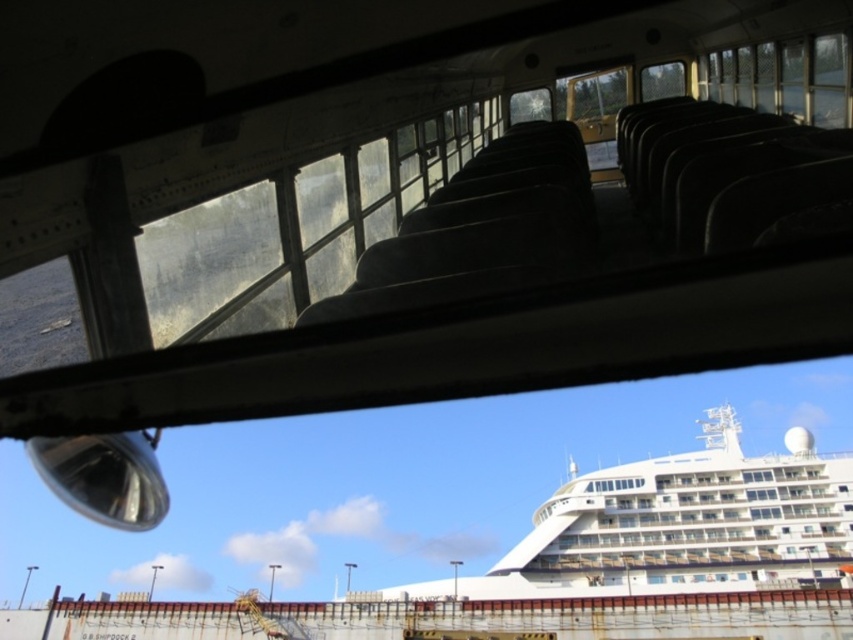
You are a passenger sitting inside the old bus and looking out through the window. You notice the white glossy cruise ship at center and the transparent plastic view mirror at lower left. Which object is positioned higher from your viewpoint?

The transparent plastic view mirror at lower left is positioned higher than the white glossy cruise ship at center from your viewpoint.

You are a passenger sitting inside the old bus and looking out through the window. You notice the white glossy cruise ship at center and the transparent plastic view mirror at lower left. Which object is located to the right side of the other?

The white glossy cruise ship at center is positioned on the right side of the transparent plastic view mirror at lower left.

You are inside the old bus looking out the window. You see two points marked on the window. The first point is at coordinate point (793, 540) and the second is at point (119, 472). Which point is closer to you?

Point (793, 540) is further to the viewer than point (119, 472), so the point closer to you is point (119, 472).